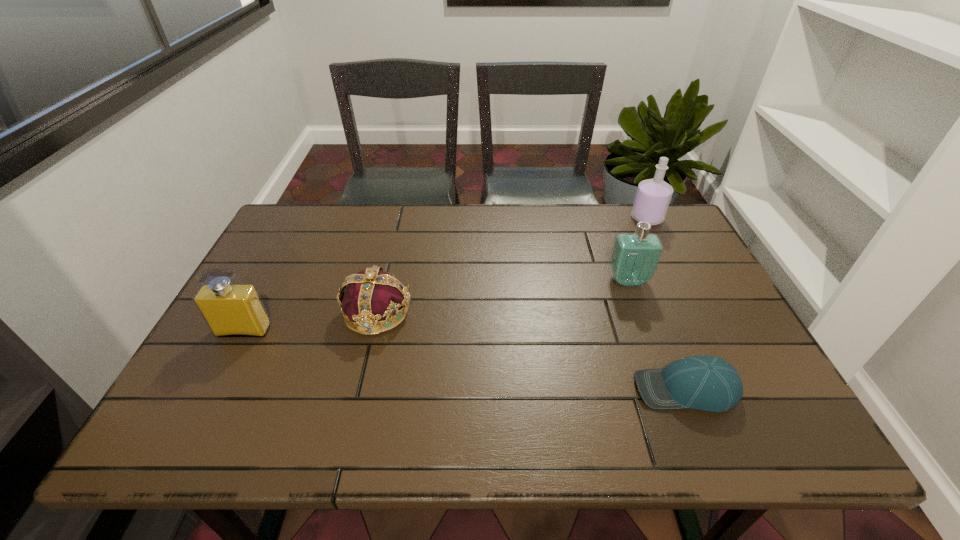
You are a GUI agent. You are given a task and a screenshot of the screen. Output one action in this format:
    pyautogui.click(x=<x>, y=<y>)
    Task: Click on the free location at the far edge of the desktop
    The image size is (960, 540).
    Given the screenshot: What is the action you would take?
    pyautogui.click(x=542, y=237)

I want to click on free region at the near edge of the desktop, so click(x=626, y=416).

This screenshot has height=540, width=960. In the image, there is a desktop. In order to click on vacant space at the left edge in this screenshot , I will do `click(215, 378)`.

In the image, there is a desktop. Identify the location of vacant region at the far left corner. (314, 209).

Where is `empty space that is in between the baseball cap and the nearest perfume`? This screenshot has height=540, width=960. empty space that is in between the baseball cap and the nearest perfume is located at coordinates (465, 360).

Image resolution: width=960 pixels, height=540 pixels. I want to click on free space that is in between the baseball cap and the crown, so click(x=531, y=351).

Find the location of a particular element. vacant area that lies between the second object from left to right and the second perfume from right to left is located at coordinates (502, 296).

Where is `vacant area that lies between the fourth tallest object and the nearest object`? The width and height of the screenshot is (960, 540). vacant area that lies between the fourth tallest object and the nearest object is located at coordinates (531, 351).

The width and height of the screenshot is (960, 540). What are the coordinates of `vacant point located between the second nearest perfume and the shortest object` in the screenshot? It's located at (657, 335).

Where is `free space between the leftmost perfume and the second perfume from left to right`? This screenshot has width=960, height=540. free space between the leftmost perfume and the second perfume from left to right is located at coordinates click(x=436, y=306).